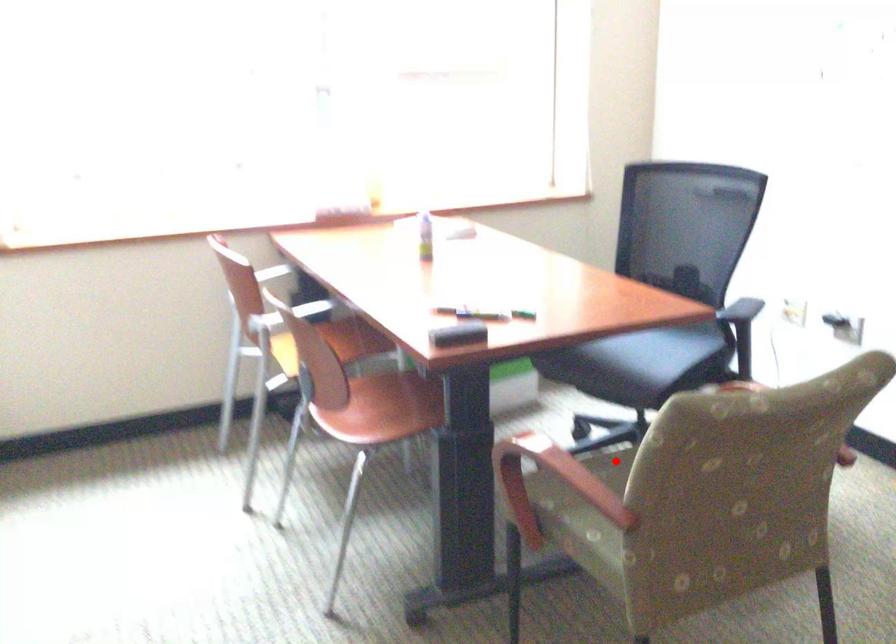
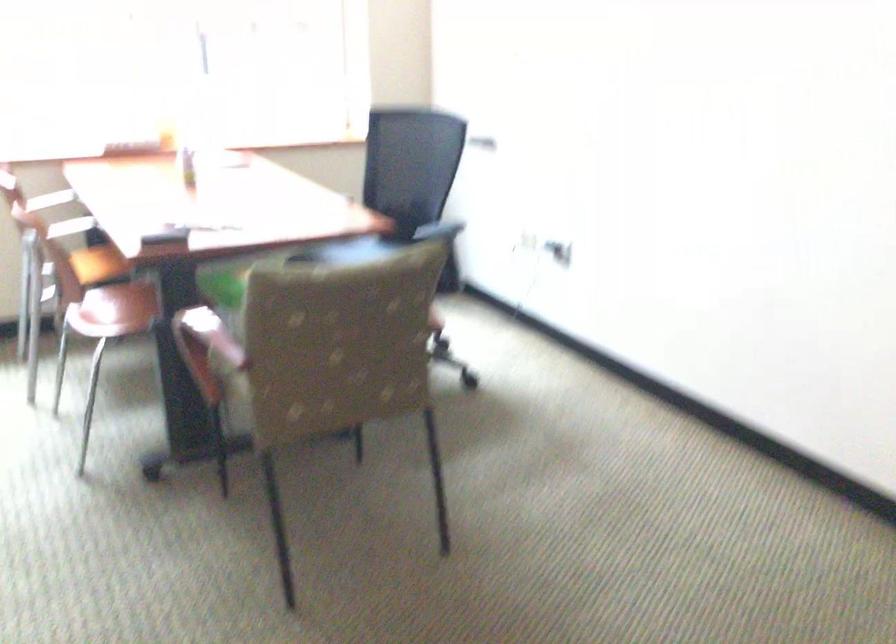
Question: I am providing you with two images of the same scene from different viewpoints. A red point is marked on the first image. At the location where the point appears in image 1, is it still visible in image 2?

Choices:
 (A) Yes
 (B) No

Answer: (B)